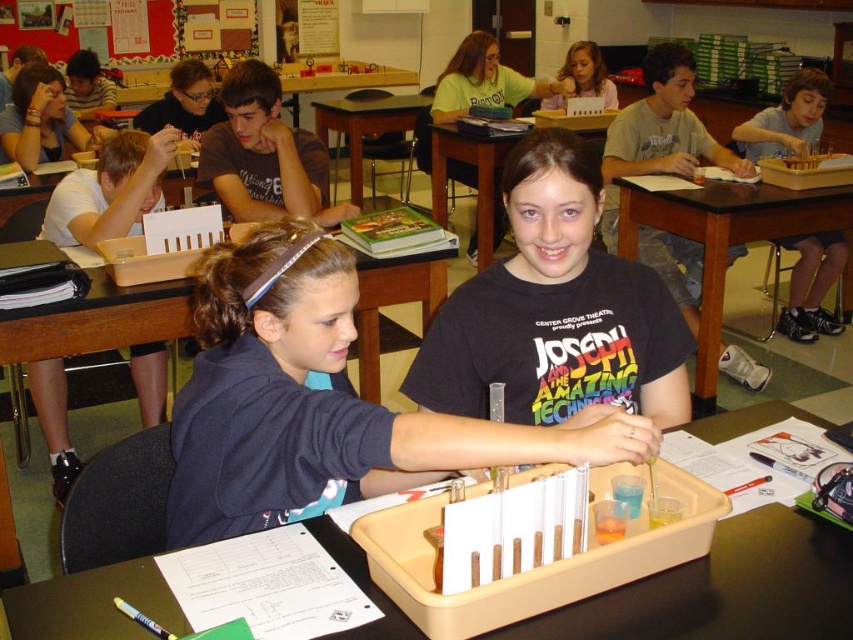
You are a student in the classroom and want to place a pencil case between the black matte shirt at center and the black plastic table at center. Which object should you place it closer to if you want the pencil case to be near the thinner object?

You should place the pencil case closer to the black matte shirt at center because it is thinner than the black plastic table at center.

You are a student in the classroom and want to reach both the point at coordinates (432, 396) and the point at coordinates (360, 584). Which point is closer to you?

The point at coordinates (360, 584) is closer to you because it is less further to the camera than point (432, 396).